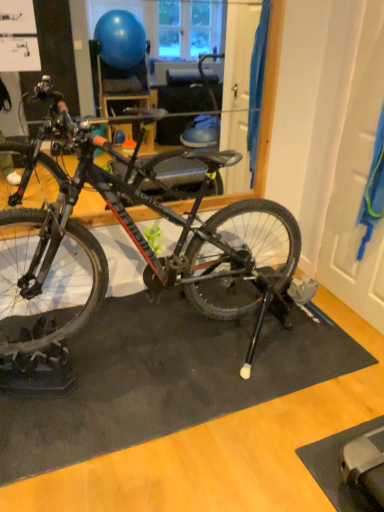
Question: Which is correct: black matte bicycle at center is inside black rubber doormat at center, or outside of it?

Choices:
 (A) inside
 (B) outside

Answer: (B)

Question: In terms of size, does black matte bicycle at center appear bigger or smaller than black rubber doormat at center?

Choices:
 (A) big
 (B) small

Answer: (A)

Question: From the image's perspective, relative to black rubber doormat at center, is black matte bicycle at center above or below?

Choices:
 (A) below
 (B) above

Answer: (B)

Question: Considering the positions of black rubber doormat at center and black matte bicycle at center in the image, is black rubber doormat at center wider or thinner than black matte bicycle at center?

Choices:
 (A) thin
 (B) wide

Answer: (A)

Question: Would you say black rubber doormat at center is inside or outside black matte bicycle at center?

Choices:
 (A) inside
 (B) outside

Answer: (B)

Question: Is black rubber doormat at center to the left or to the right of black matte bicycle at center in the image?

Choices:
 (A) right
 (B) left

Answer: (A)

Question: Does point (296, 320) appear closer or farther from the camera than point (221, 266)?

Choices:
 (A) closer
 (B) farther

Answer: (B)